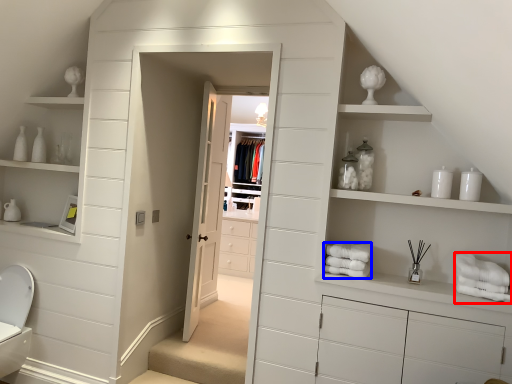
Question: Which object appears closest to the camera in this image, bath towel (highlighted by a red box) or bath towel (highlighted by a blue box)?

Choices:
 (A) bath towel
 (B) bath towel

Answer: (A)